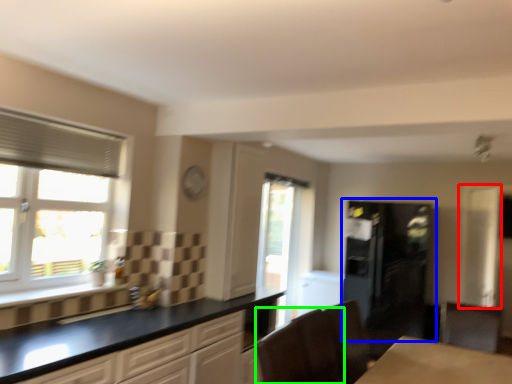
Question: Estimate the real-world distances between objects in this image. Which object is farther from screen door (highlighted by a red box), fridge (highlighted by a blue box) or armchair (highlighted by a green box)?

Choices:
 (A) fridge
 (B) armchair

Answer: (B)